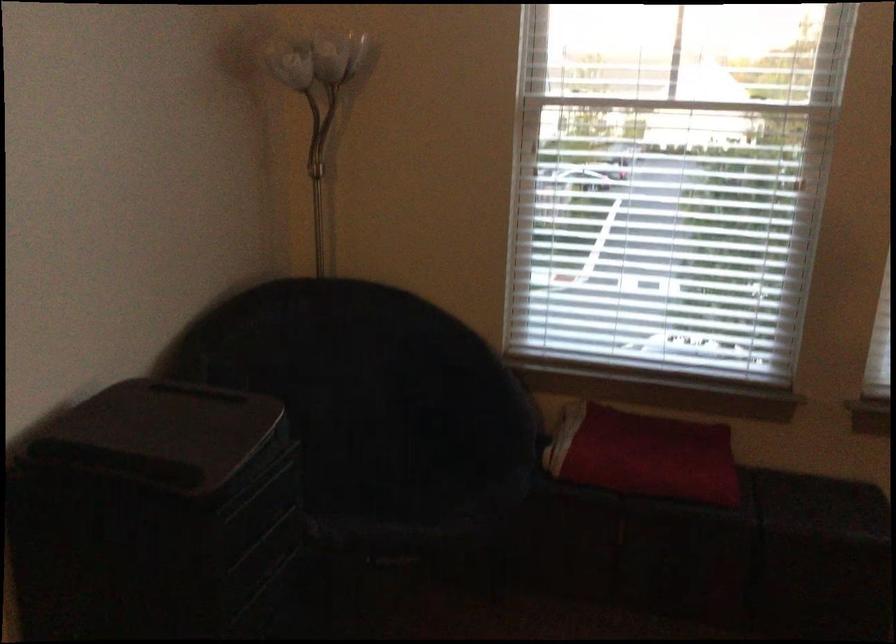
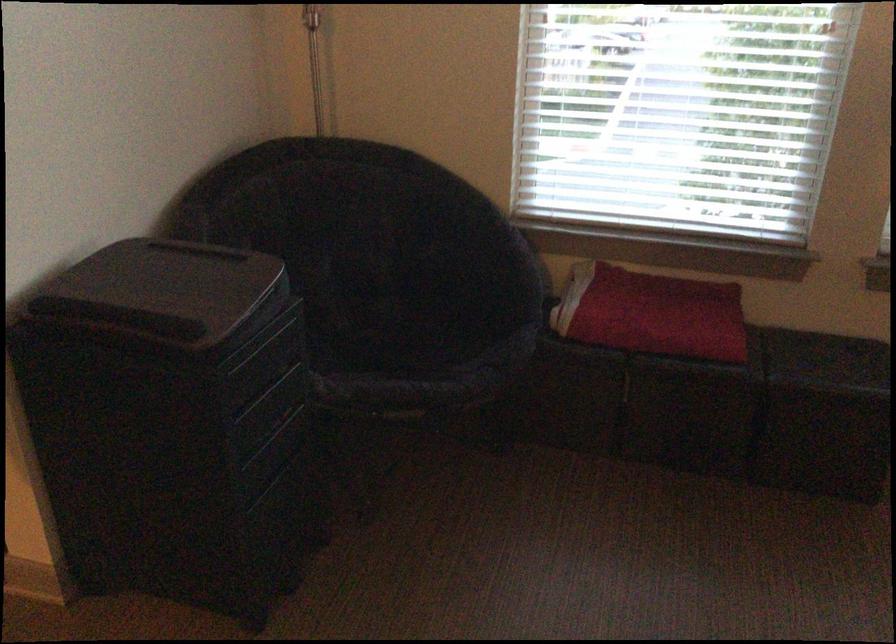
Find the pixel in the second image that matches pixel 187 422 in the first image.

(188, 281)